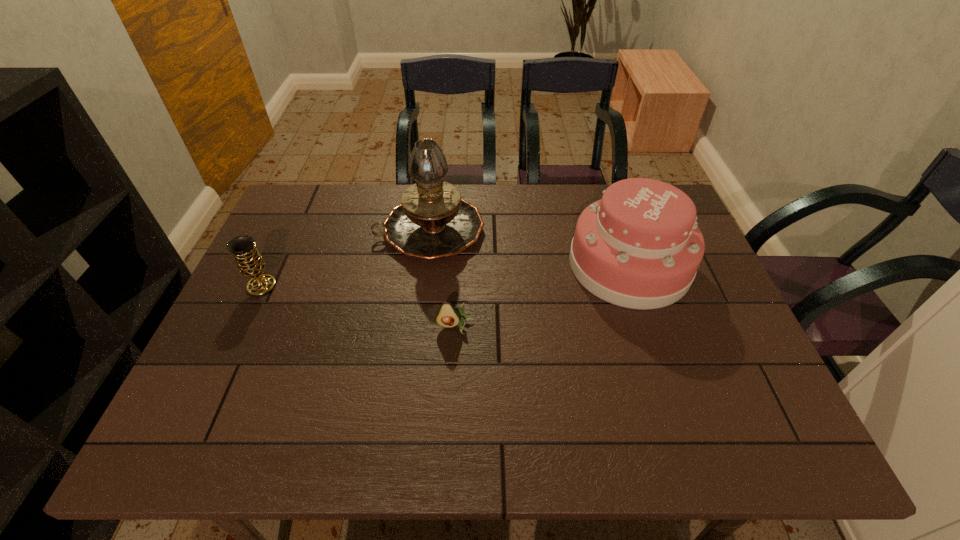
What are the coordinates of `the tallest object` in the screenshot? It's located at (433, 221).

Where is `the rightmost object`? This screenshot has height=540, width=960. the rightmost object is located at coordinates [x=639, y=247].

This screenshot has height=540, width=960. In order to click on birthday cake in this screenshot , I will do `click(639, 247)`.

Locate an element on the screen. The width and height of the screenshot is (960, 540). the third tallest object is located at coordinates (243, 248).

This screenshot has width=960, height=540. I want to click on chalice, so click(243, 248).

Find the location of a particular element. The image size is (960, 540). the shortest object is located at coordinates click(448, 317).

Where is `avocado`? Image resolution: width=960 pixels, height=540 pixels. avocado is located at coordinates (448, 317).

The height and width of the screenshot is (540, 960). I want to click on vacant area situated on the right of the oil lamp, so click(540, 230).

This screenshot has width=960, height=540. What are the coordinates of `free region located on the back of the third shortest object` in the screenshot? It's located at (610, 207).

Where is `vacant space located on the back of the chalice`? The image size is (960, 540). vacant space located on the back of the chalice is located at coordinates (302, 199).